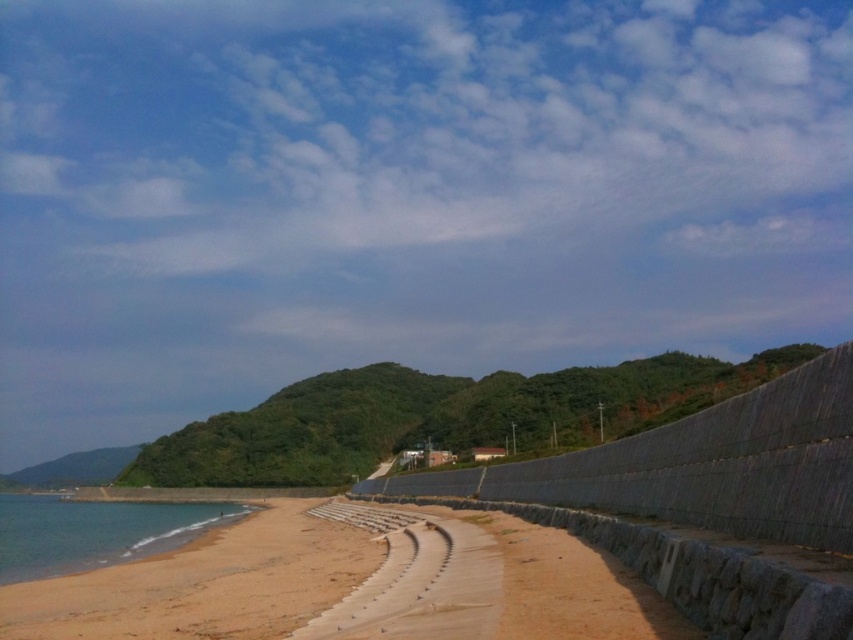
Between gray concrete wall at center and brown sandy beach at lower left, which one appears on the left side from the viewer's perspective?

brown sandy beach at lower left is more to the left.

Which is in front, point (711, 508) or point (64, 584)?

Point (711, 508) is more forward.

Is point (770, 465) more distant than point (202, 602)?

No, it is not.

Find the location of a particular element. The image size is (853, 640). gray concrete wall at center is located at coordinates (701, 465).

How far apart are brown sandy beach at lower left and clear blue water at lower left?

68.98 meters

What do you see at coordinates (204, 582) in the screenshot? I see `brown sandy beach at lower left` at bounding box center [204, 582].

Does point (296, 618) come closer to viewer compared to point (131, 513)?

Yes, point (296, 618) is closer to viewer.

Identify the location of brown sandy beach at lower left. The height and width of the screenshot is (640, 853). (204, 582).

Can you confirm if gray concrete wall at center is smaller than clear blue water at lower left?

Yes.

Is gray concrete wall at center shorter than clear blue water at lower left?

Correct, gray concrete wall at center is not as tall as clear blue water at lower left.

Which is behind, point (810, 385) or point (221, 508)?

The point (221, 508) is behind.

I want to click on gray concrete wall at center, so click(701, 465).